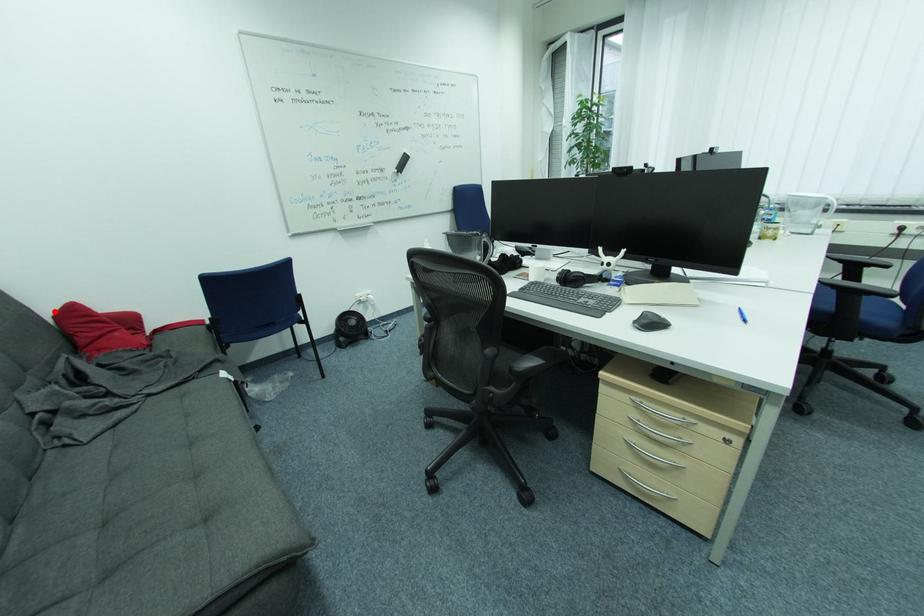
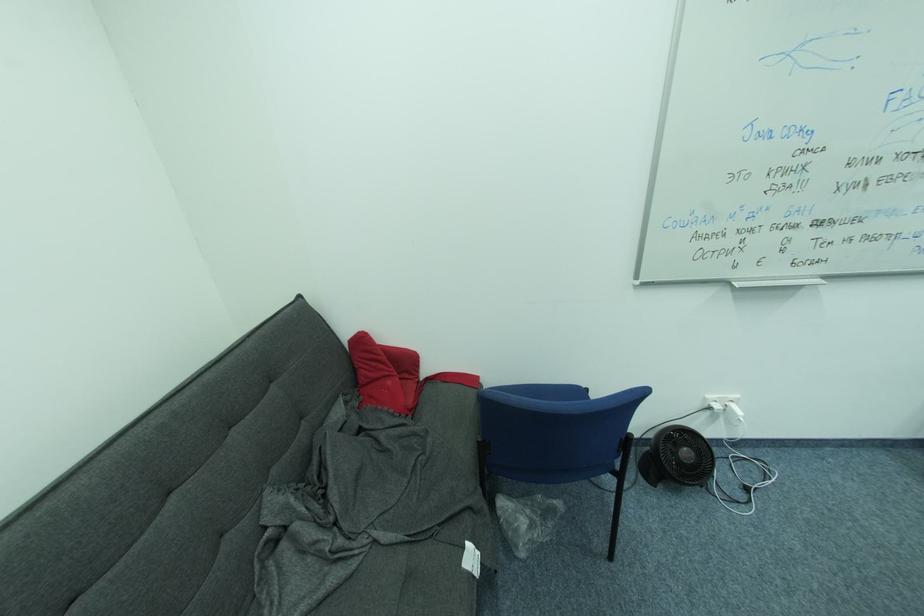
Question: I am providing you with two images of the same scene from different viewpoints. Image1 has a red point marked. In image2, the corresponding 3D location appears at what relative position? Reply with the corresponding letter.

Choices:
 (A) Closer
 (B) Farther

Answer: (A)